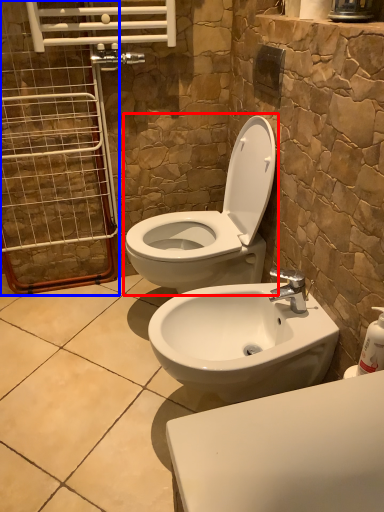
Question: Which object appears farthest to the camera in this image, toilet (highlighted by a red box) or screen door (highlighted by a blue box)?

Choices:
 (A) toilet
 (B) screen door

Answer: (B)